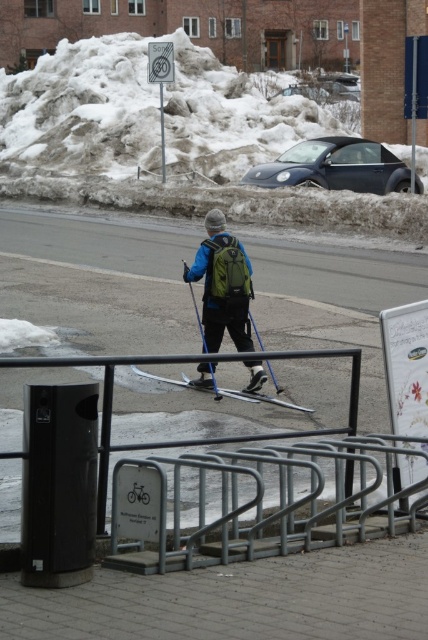
You are a drone operator trying to capture the skier and the snow pile in a single aerial shot. The skier is at point (148, 588) and the snow pile is at point (211, 305). From your current position, which point should you adjust your camera to focus on first to ensure both are in frame?

Point (148, 588) is in front of point (211, 305), so you should focus on the point (148, 588) first to ensure both are visible in the frame.

You are a delivery drone operator. Your drone is flying above the urban winter scene. You need to deliver a package to the matte blue jacket at center. However, there is a brushed metal pole at upper center in your flight path. Can your drone safely navigate around the pole to reach the target?

The matte blue jacket at center is below the brushed metal pole at upper center, so the drone can safely navigate around the pole by flying under it to reach the target.

You are a photographer trying to capture the matte blue jacket at center and the brushed metal pole at upper center in the same frame. Based on their positions, which object appears taller in the photo?

The brushed metal pole at upper center appears taller in the photo because the matte blue jacket at center has a lesser height compared to it.